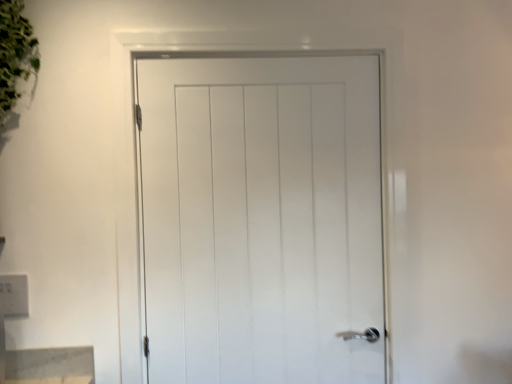
Locate an element on the screen. This screenshot has width=512, height=384. free space above white wooden door at center (from a real-world perspective) is located at coordinates (253, 49).